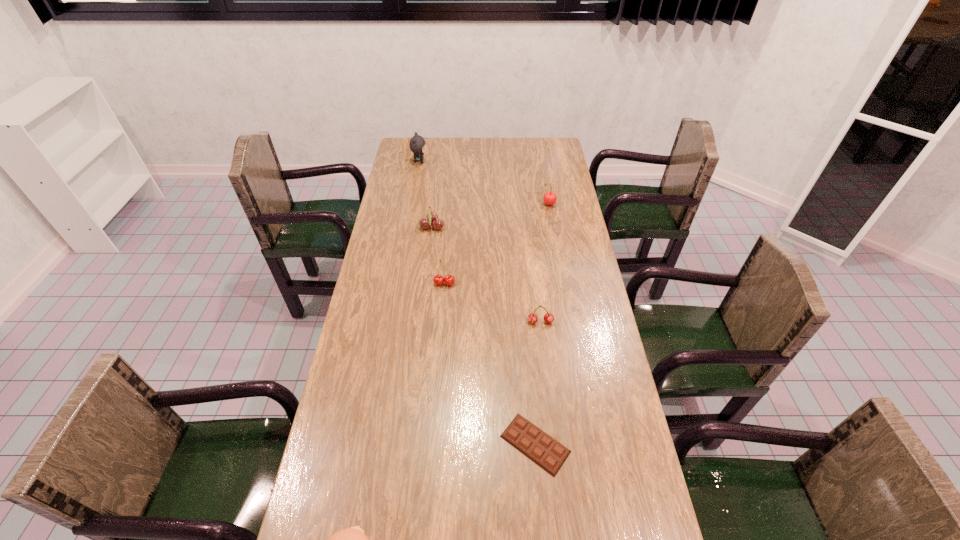
The height and width of the screenshot is (540, 960). Find the location of `kitten`. kitten is located at coordinates (417, 144).

This screenshot has height=540, width=960. I want to click on the rightmost object, so click(549, 198).

The image size is (960, 540). Identify the location of the farthest cherry. (549, 198).

I want to click on the fourth nearest object, so click(449, 280).

Locate an element on the screen. the third nearest cherry is located at coordinates (431, 217).

Find the location of a particular element. the shortest cherry is located at coordinates (532, 318).

Where is `the nearest cherry`? Image resolution: width=960 pixels, height=540 pixels. the nearest cherry is located at coordinates (532, 318).

At what (x,y) coordinates should I click in order to perform the action: click on the shortest object. Please return your answer as a coordinate pair (x, y). Looking at the image, I should click on (542, 449).

The image size is (960, 540). I want to click on chocolate bar, so click(x=542, y=449).

I want to click on vacant space located on the front-facing side of the farthest object, so click(x=438, y=162).